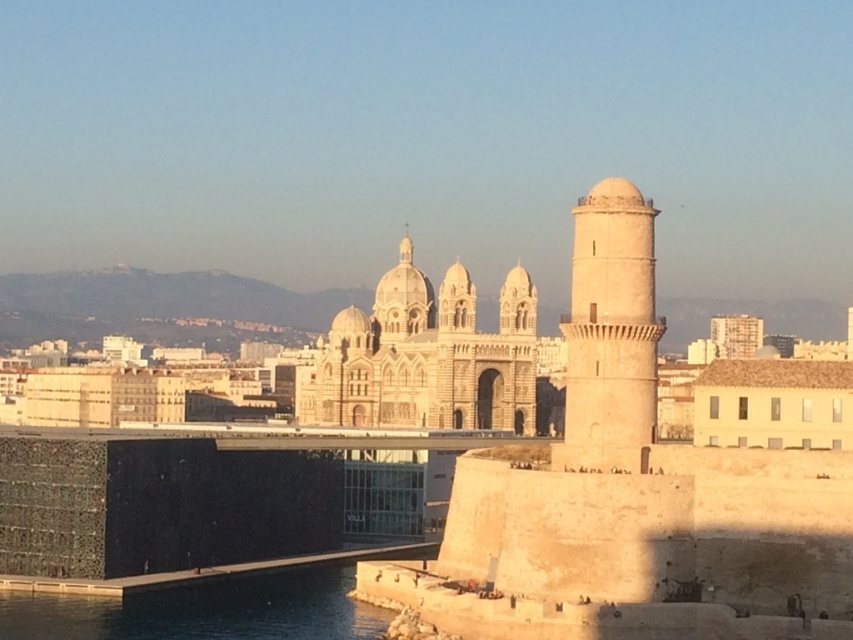
Can you confirm if light beige stone tower at right is positioned above blue glass water at lower left?

Correct, light beige stone tower at right is located above blue glass water at lower left.

Does light beige stone tower at right have a smaller size compared to blue glass water at lower left?

No.

You are a GUI agent. You are given a task and a screenshot of the screen. Output one action in this format:
    pyautogui.click(x=<x>, y=<y>)
    Task: Click on the light beige stone tower at right
    
    Given the screenshot: What is the action you would take?
    pyautogui.click(x=610, y=332)

This screenshot has width=853, height=640. In order to click on light beige stone tower at right in this screenshot , I will do `click(610, 332)`.

Which is more to the left, beige stone cathedral at center or light beige stone tower at right?

Positioned to the left is beige stone cathedral at center.

Is beige stone cathedral at center shorter than light beige stone tower at right?

No, beige stone cathedral at center is not shorter than light beige stone tower at right.

Who is more distant from viewer, (503, 422) or (590, 218)?

Point (503, 422)

What are the coordinates of `beige stone cathedral at center` in the screenshot? It's located at (425, 356).

Consider the image. Between beige stone cathedral at center and blue glass water at lower left, which one has more height?

Standing taller between the two is beige stone cathedral at center.

Does beige stone cathedral at center appear over blue glass water at lower left?

Yes, beige stone cathedral at center is above blue glass water at lower left.

What do you see at coordinates (425, 356) in the screenshot?
I see `beige stone cathedral at center` at bounding box center [425, 356].

The width and height of the screenshot is (853, 640). Find the location of `beige stone cathedral at center`. beige stone cathedral at center is located at coordinates (425, 356).